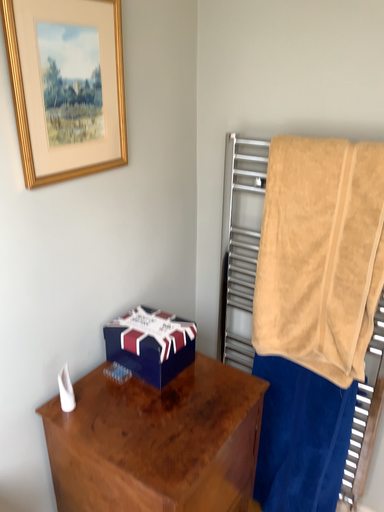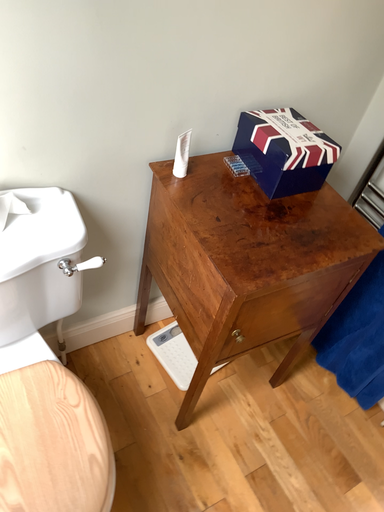
Question: Which way did the camera rotate in the video?

Choices:
 (A) rotated right
 (B) rotated left

Answer: (B)